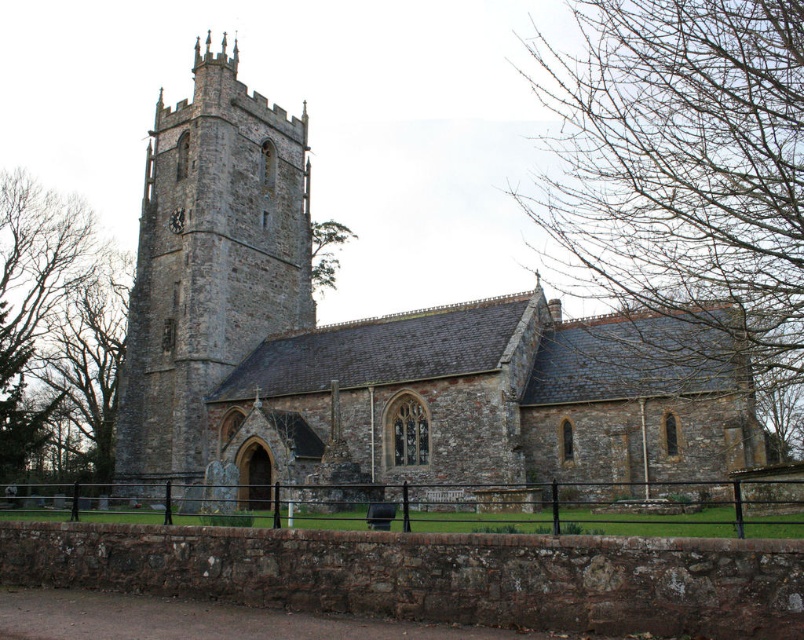
You are standing in front of the stone church at center and want to walk towards the black metal fence at lower center. Which direction should you move to get closer to the fence?

You should move forward towards the black metal fence at lower center because it is located closer to you than the stone church at center, which is behind it.

You are standing in front of the church and want to determine which object is taller between the bare branches at upper right and the black metal fence at lower center. Based on the scene, which one is taller?

The bare branches at upper right has a greater height compared to the black metal fence at lower center, so the bare branches at upper right is taller.

You are standing in front of the stone church at center and want to walk towards the black metal fence at lower center. Can you walk directly towards it without going around the church?

The black metal fence at lower center is behind the stone church at center, so you cannot walk directly towards it without going around the church.